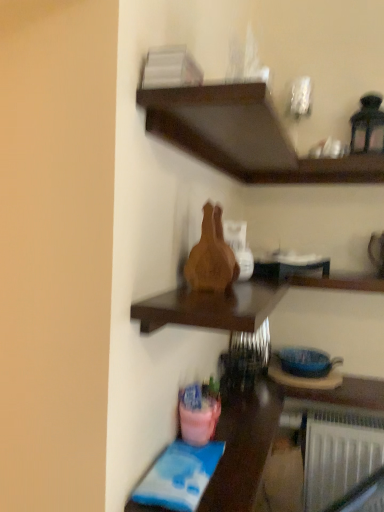
Question: Does pink plastic bucket at lower left have a lesser height compared to dark wood shelf at upper center, marked as the first shelf in a top-to-bottom arrangement?

Choices:
 (A) yes
 (B) no

Answer: (B)

Question: From the image's perspective, is pink plastic bucket at lower left located beneath dark wood shelf at upper center, marked as the first shelf in a top-to-bottom arrangement?

Choices:
 (A) no
 (B) yes

Answer: (B)

Question: Considering the relative positions of pink plastic bucket at lower left and dark wood shelf at upper center, positioned as the second shelf in bottom-to-top order, in the image provided, is pink plastic bucket at lower left to the left of dark wood shelf at upper center, positioned as the second shelf in bottom-to-top order, from the viewer's perspective?

Choices:
 (A) yes
 (B) no

Answer: (A)

Question: Is pink plastic bucket at lower left bigger than dark wood shelf at upper center, marked as the first shelf in a top-to-bottom arrangement?

Choices:
 (A) no
 (B) yes

Answer: (B)

Question: Does pink plastic bucket at lower left have a greater width compared to dark wood shelf at upper center, marked as the first shelf in a top-to-bottom arrangement?

Choices:
 (A) no
 (B) yes

Answer: (A)

Question: Is pink plastic bucket at lower left smaller than dark wood shelf at upper center, marked as the first shelf in a top-to-bottom arrangement?

Choices:
 (A) yes
 (B) no

Answer: (B)

Question: Is the depth of dark wood shelf at upper center, marked as the first shelf in a top-to-bottom arrangement, greater than that of pink plastic bucket at lower left?

Choices:
 (A) no
 (B) yes

Answer: (A)

Question: Is dark wood shelf at upper center, positioned as the second shelf in bottom-to-top order, not inside pink plastic bucket at lower left?

Choices:
 (A) yes
 (B) no

Answer: (A)

Question: Is dark wood shelf at upper center, marked as the first shelf in a top-to-bottom arrangement, positioned with its back to pink plastic bucket at lower left?

Choices:
 (A) no
 (B) yes

Answer: (A)

Question: From the image's perspective, does dark wood shelf at upper center, positioned as the second shelf in bottom-to-top order, appear lower than pink plastic bucket at lower left?

Choices:
 (A) no
 (B) yes

Answer: (A)

Question: Is pink plastic bucket at lower left completely or partially inside dark wood shelf at upper center, marked as the first shelf in a top-to-bottom arrangement?

Choices:
 (A) no
 (B) yes

Answer: (A)

Question: From the image's perspective, would you say dark wood shelf at upper center, positioned as the second shelf in bottom-to-top order, is shown under wooden vase at center, which is the 1th shelf from bottom to top?

Choices:
 (A) no
 (B) yes

Answer: (A)